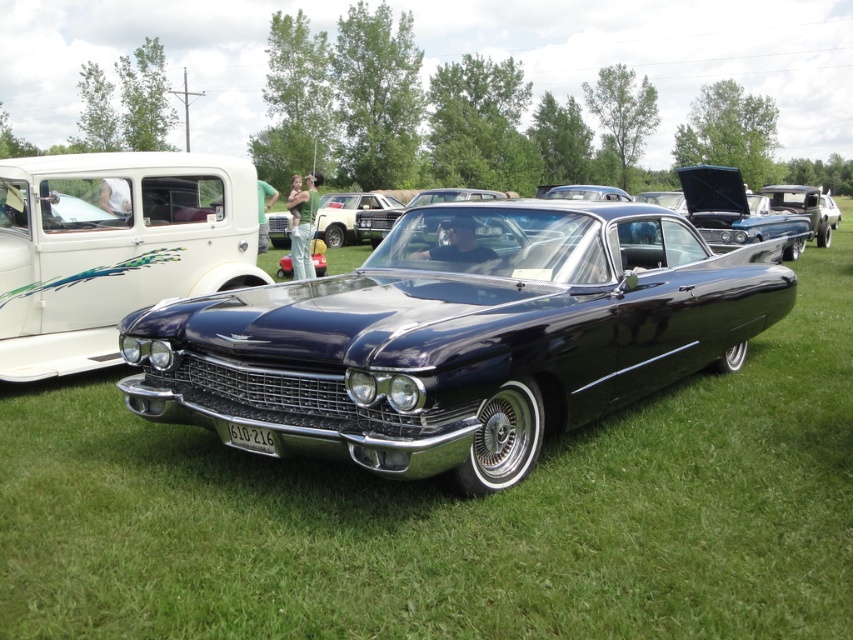
You are a photographer at the car show and want to capture both the shiny dark blue car at center and the white glossy pickup truck at upper left in the same frame. Based on their positions, which car should you focus on first to ensure both are in the shot?

The shiny dark blue car at center is below the white glossy pickup truck at upper left, so you should focus on the white glossy pickup truck at upper left first to ensure both are in the shot.

You are a photographer trying to capture the shiny dark blue car at center and the white glossy pickup truck at upper left in a single frame. Since you want to emphasize the height difference between them, which car should you position closer to the camera to make the one appear taller?

To emphasize the height difference, position the shiny dark blue car at center closer to the camera because it is shorter than the white glossy pickup truck at upper left. This will make the shiny dark blue car at center appear taller in the photo relative to the pickup truck, even though it is actually shorter.

You are a photographer setting up equipment for the car show. You need to place a large backdrop behind the shiny dark blue car at center and the white glossy pickup truck at upper left. Which car requires a larger backdrop to fully cover its rear side?

The shiny dark blue car at center requires a larger backdrop since it is bigger than the white glossy pickup truck at upper left.